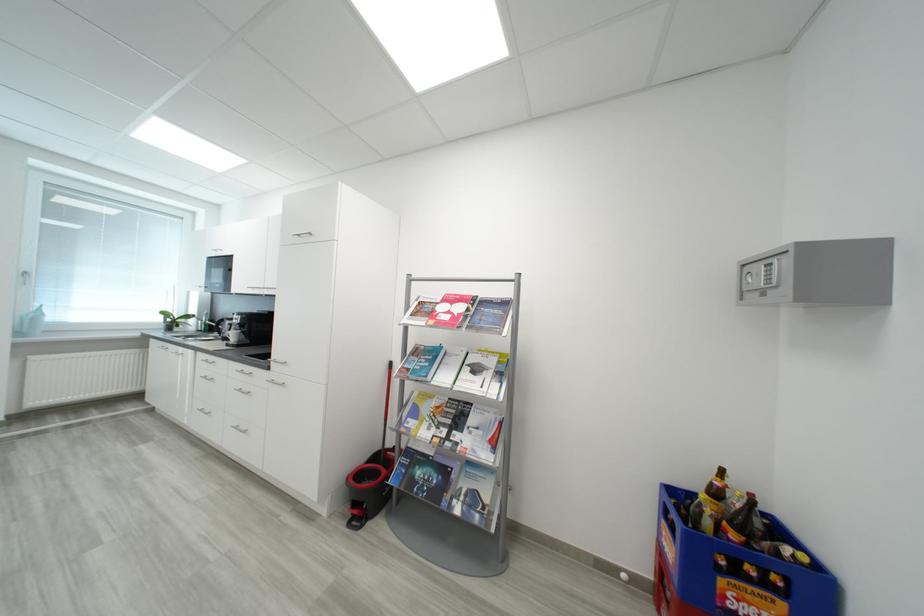
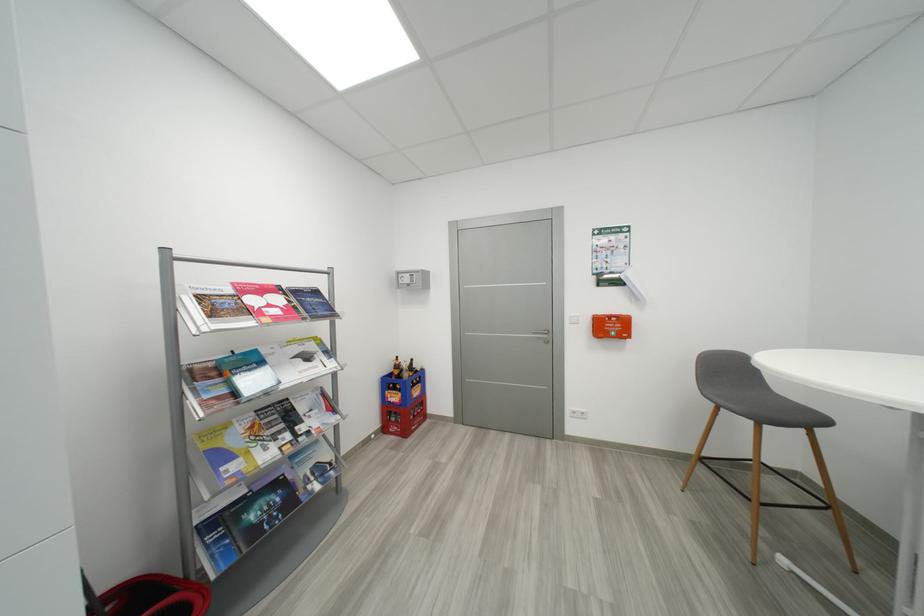
Locate, in the second image, the point that corresponds to (482,371) in the first image.

(314, 359)